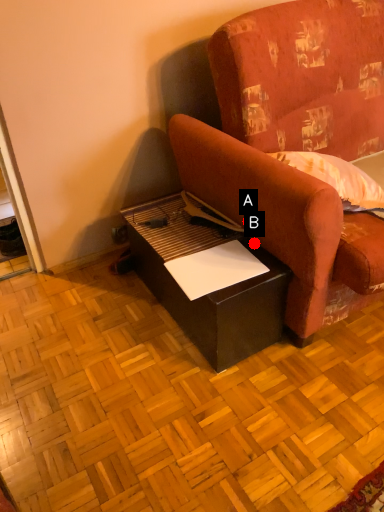
Question: Two points are circled on the image, labeled by A and B beside each circle. Which point is farther to the camera?

Choices:
 (A) A is further
 (B) B is further

Answer: (B)